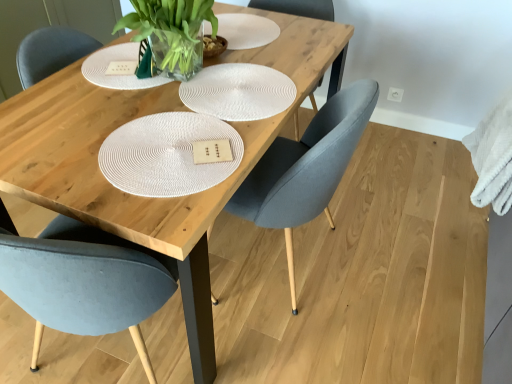
Question: Considering the relative sizes of white fluffy towel at right and matte gray chair at center, which appears as the 2th chair when viewed from the left, in the image provided, is white fluffy towel at right bigger than matte gray chair at center, which appears as the 2th chair when viewed from the left,?

Choices:
 (A) no
 (B) yes

Answer: (A)

Question: Considering the relative positions of white fluffy towel at right and matte gray chair at center, which is counted as the 1th chair, starting from the right, in the image provided, is white fluffy towel at right to the right of matte gray chair at center, which is counted as the 1th chair, starting from the right, from the viewer's perspective?

Choices:
 (A) yes
 (B) no

Answer: (A)

Question: From the image's perspective, is white fluffy towel at right on matte gray chair at center, which is counted as the 1th chair, starting from the right?

Choices:
 (A) no
 (B) yes

Answer: (B)

Question: From a real-world perspective, is white fluffy towel at right under matte gray chair at center, which appears as the 2th chair when viewed from the left?

Choices:
 (A) no
 (B) yes

Answer: (A)

Question: Considering the relative sizes of white fluffy towel at right and matte gray chair at center, which is counted as the 1th chair, starting from the right, in the image provided, is white fluffy towel at right thinner than matte gray chair at center, which is counted as the 1th chair, starting from the right,?

Choices:
 (A) yes
 (B) no

Answer: (A)

Question: Considering the relative positions of matte gray chair at center, which ranks as the 1th chair in left-to-right order, and white woven placemat at center in the image provided, is matte gray chair at center, which ranks as the 1th chair in left-to-right order, to the left or to the right of white woven placemat at center?

Choices:
 (A) left
 (B) right

Answer: (A)

Question: From their relative heights in the image, would you say matte gray chair at center, marked as the 2th chair in a right-to-left arrangement, is taller or shorter than white woven placemat at center?

Choices:
 (A) short
 (B) tall

Answer: (B)

Question: Is matte gray chair at center, marked as the 2th chair in a right-to-left arrangement, spatially inside white woven placemat at center, or outside of it?

Choices:
 (A) inside
 (B) outside

Answer: (B)

Question: Is matte gray chair at center, marked as the 2th chair in a right-to-left arrangement, bigger or smaller than white woven placemat at center?

Choices:
 (A) big
 (B) small

Answer: (A)

Question: From the image's perspective, is matte gray chair at center, which is counted as the 1th chair, starting from the right, above or below white woven placemat at center?

Choices:
 (A) above
 (B) below

Answer: (B)

Question: Looking at their shapes, would you say matte gray chair at center, which is counted as the 1th chair, starting from the right, is wider or thinner than white woven placemat at center?

Choices:
 (A) wide
 (B) thin

Answer: (A)

Question: In terms of height, does matte gray chair at center, which is counted as the 1th chair, starting from the right, look taller or shorter compared to white woven placemat at center?

Choices:
 (A) tall
 (B) short

Answer: (A)

Question: In the image, is matte gray chair at center, which appears as the 2th chair when viewed from the left, on the left side or the right side of white woven placemat at center?

Choices:
 (A) left
 (B) right

Answer: (B)

Question: Visually, is wooden table at center positioned to the left or to the right of white fluffy towel at right?

Choices:
 (A) right
 (B) left

Answer: (B)

Question: Is wooden table at center in front of or behind white fluffy towel at right in the image?

Choices:
 (A) front
 (B) behind

Answer: (A)